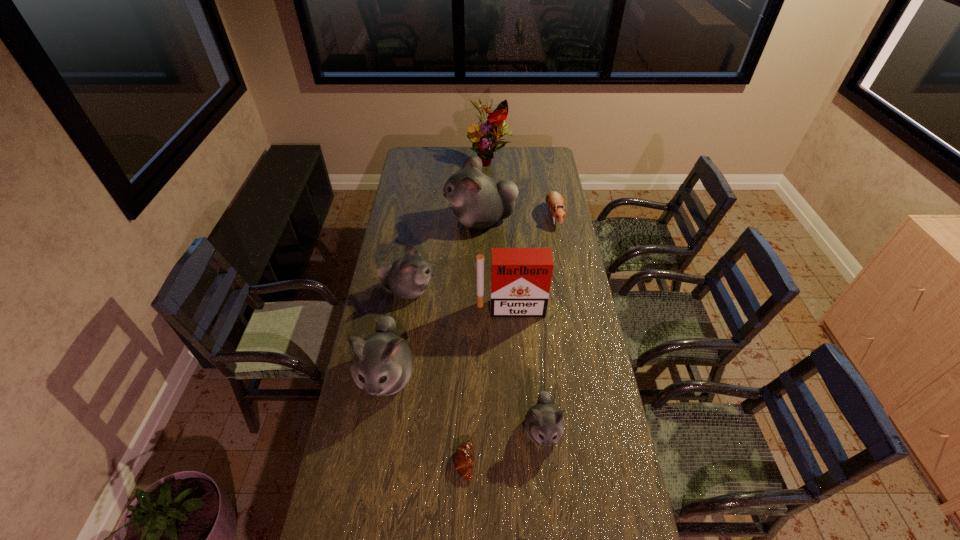
Locate an element on the screen. vacant position in the image that satisfies the following two spatial constraints: 1. at the face of the shortest hamster; 2. on the face of the biggest white hamster is located at coordinates (555, 220).

At what (x,y) coordinates should I click in order to perform the action: click on vacant space that satisfies the following two spatial constraints: 1. on the back side of the shortest object; 2. on the face of the third tallest hamster. Please return your answer as a coordinate pair (x, y). This screenshot has height=540, width=960. Looking at the image, I should click on (468, 290).